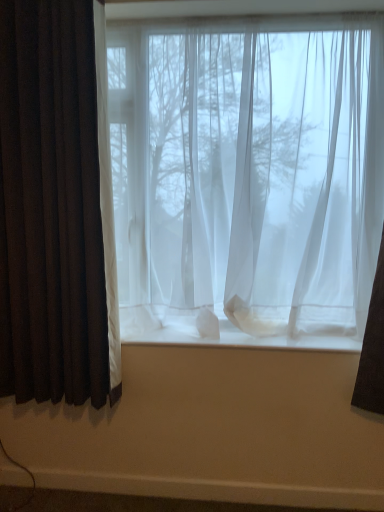
Question: Does point (243, 230) appear closer or farther from the camera than point (281, 327)?

Choices:
 (A) closer
 (B) farther

Answer: (A)

Question: Looking at their shapes, would you say sheer white curtains at center is wider or thinner than white sheer curtain at center?

Choices:
 (A) wide
 (B) thin

Answer: (A)

Question: Based on their relative distances, which object is nearer to the sheer white curtains at center?

Choices:
 (A) white sheer curtain at center
 (B) dark brown velvet curtain at left

Answer: (A)

Question: Estimate the real-world distances between objects in this image. Which object is farther from the sheer white curtains at center?

Choices:
 (A) dark brown velvet curtain at left
 (B) white sheer curtain at center

Answer: (A)